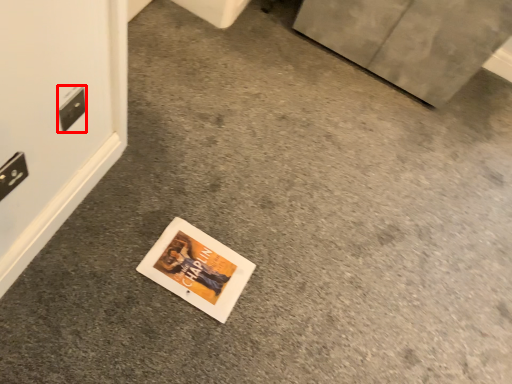
Question: Where is electric outlet (annotated by the red box) located in relation to electric outlet in the image?

Choices:
 (A) left
 (B) right

Answer: (B)